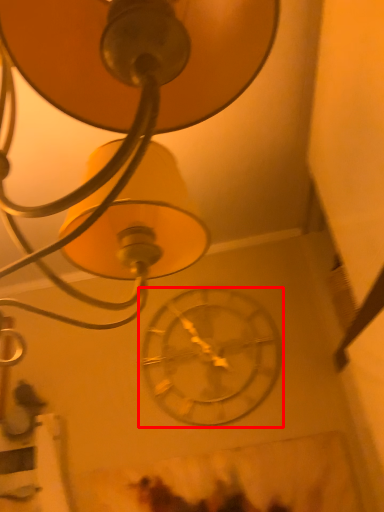
Question: Considering the relative positions of wall clock (annotated by the red box) and lamp in the image provided, where is wall clock (annotated by the red box) located with respect to the staircase?

Choices:
 (A) left
 (B) right

Answer: (B)